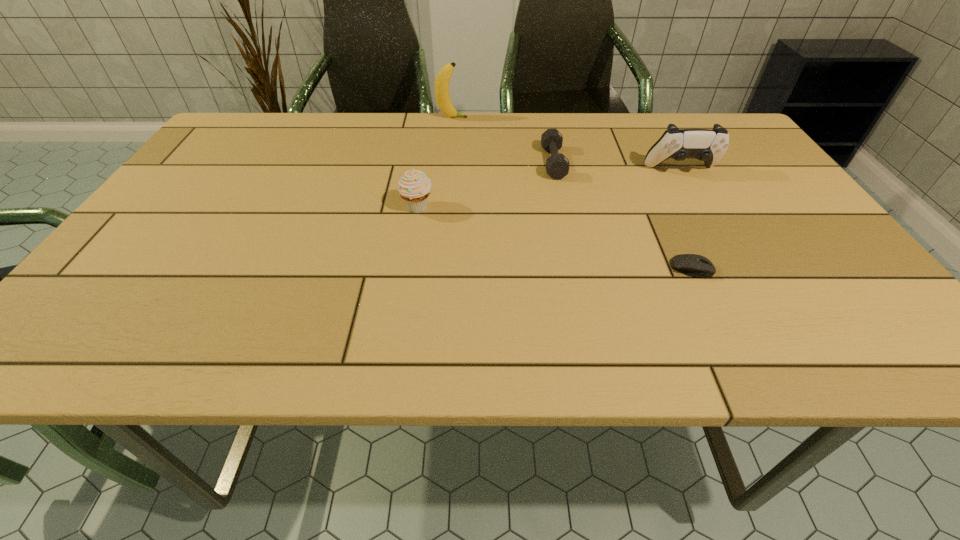
You are a GUI agent. You are given a task and a screenshot of the screen. Output one action in this format:
    pyautogui.click(x=<x>, y=<y>)
    Task: Click on the blank region between the shortest object and the farthest object
    The image size is (960, 540).
    Given the screenshot: What is the action you would take?
    pyautogui.click(x=572, y=193)

Image resolution: width=960 pixels, height=540 pixels. Identify the location of free space between the control and the muffin. (549, 189).

You are a GUI agent. You are given a task and a screenshot of the screen. Output one action in this format:
    pyautogui.click(x=<x>, y=<y>)
    Task: Click on the vacant area that lies between the farthest object and the nearest object
    The width and height of the screenshot is (960, 540).
    Given the screenshot: What is the action you would take?
    pyautogui.click(x=572, y=193)

Locate which object is the third closest to the computer equipment. Please provide its 2D coordinates. Your answer should be formatted as a tuple, i.e. [(x, y)], where the tuple contains the x and y coordinates of a point satisfying the conditions above.

[(414, 186)]

Select which object appears as the closest to the tallest object. Please provide its 2D coordinates. Your answer should be formatted as a tuple, i.e. [(x, y)], where the tuple contains the x and y coordinates of a point satisfying the conditions above.

[(557, 165)]

The width and height of the screenshot is (960, 540). I want to click on free space that satisfies the following two spatial constraints: 1. on the back side of the third shortest object; 2. on the left side of the third object from right to left, so click(x=424, y=163).

I want to click on free space that satisfies the following two spatial constraints: 1. from the stem of the tallest object; 2. on the back side of the third object from left to right, so click(447, 163).

Identify the location of vacant space that satisfies the following two spatial constraints: 1. from the stem of the farthest object; 2. on the front side of the third shortest object. This screenshot has width=960, height=540. (444, 208).

Where is `blank area in the image that satisfies the following two spatial constraints: 1. from the stem of the dumbbell; 2. on the right side of the tallest object`? The height and width of the screenshot is (540, 960). blank area in the image that satisfies the following two spatial constraints: 1. from the stem of the dumbbell; 2. on the right side of the tallest object is located at coordinates (447, 163).

You are a GUI agent. You are given a task and a screenshot of the screen. Output one action in this format:
    pyautogui.click(x=<x>, y=<y>)
    Task: Click on the blank space that satisfies the following two spatial constraints: 1. on the back side of the second shortest object; 2. on the right side of the fourth farthest object
    
    Given the screenshot: What is the action you would take?
    pyautogui.click(x=424, y=163)